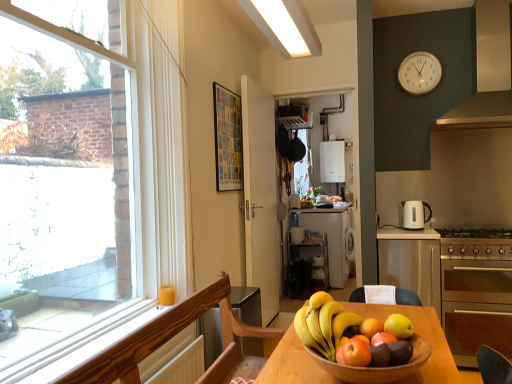
Identify the location of free location to the left of matte red apple at center, arranged as the first apple when viewed from the front. Image resolution: width=512 pixels, height=384 pixels. (323, 359).